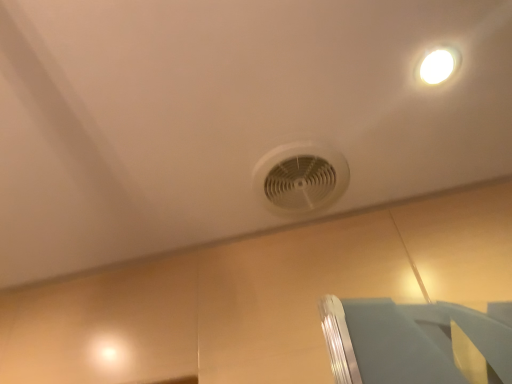
Where is `white plastic mechanical fan at center`? The height and width of the screenshot is (384, 512). white plastic mechanical fan at center is located at coordinates (300, 178).

Describe the element at coordinates (300, 178) in the screenshot. The width and height of the screenshot is (512, 384). I see `white plastic mechanical fan at center` at that location.

This screenshot has width=512, height=384. I want to click on white plastic mechanical fan at center, so click(300, 178).